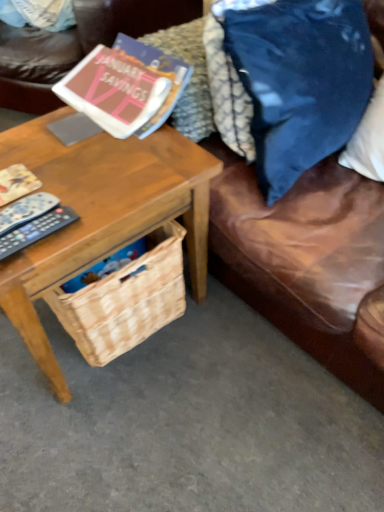
This screenshot has height=512, width=384. Identify the location of spots to the right of black plastic remote control at left, the second remote control positioned from the top. (99, 216).